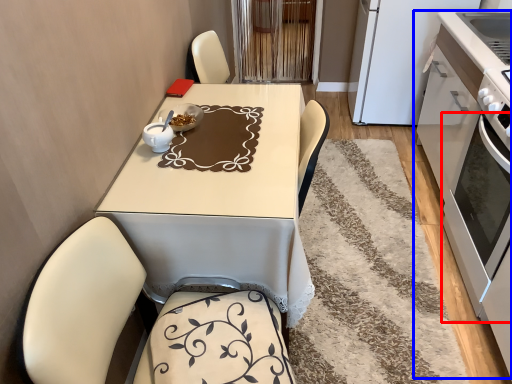
Question: Which of the following is the closest to the observer, oven (highlighted by a red box) or cabinetry (highlighted by a blue box)?

Choices:
 (A) oven
 (B) cabinetry

Answer: (A)